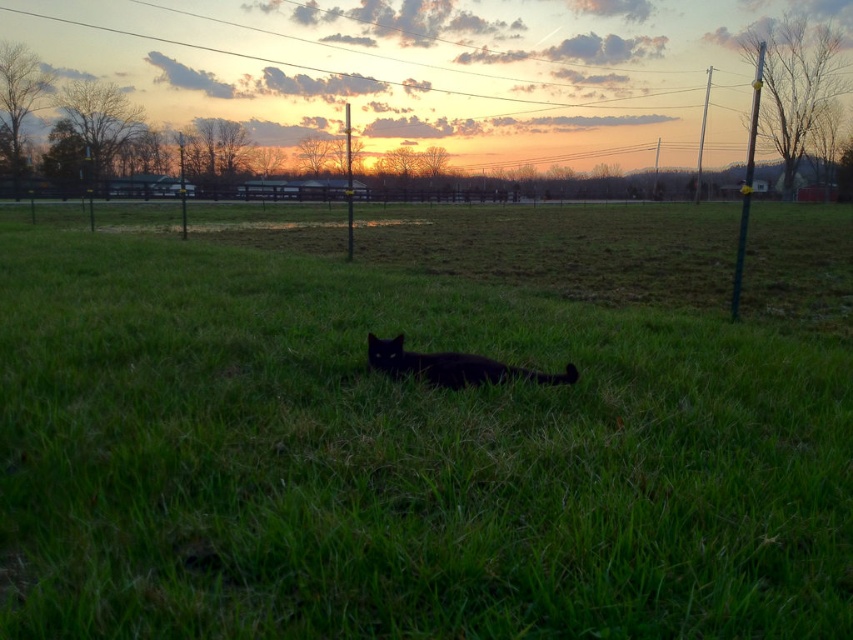
You are standing at the origin point of the coordinate system where the bottom left corner of the image is at point 0,0. You want to walk to the green grass at center. Which direction should you walk to reach it?

Answer: Since the green grass at center is located at coordinate point (x=424, y=424), you should walk northeast to reach it.

You are a photographer trying to capture the black matte cat at center. You notice the green grass at center is covering part of the cat. Can you adjust your position to get a clearer view of the cat without moving the grass?

The green grass at center is positioned over black matte cat at center, so moving your camera angle slightly downward might help reveal more of the cat underneath the grass.